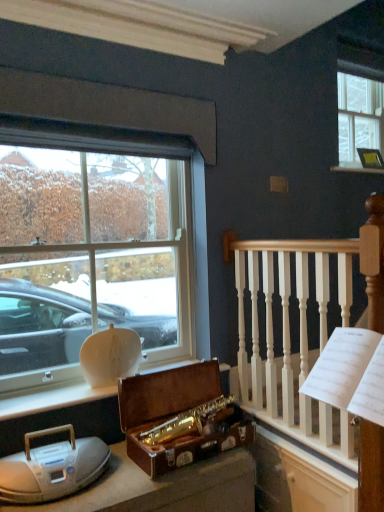
Question: Could you tell me if metallic gold picture frame at upper right is facing white wood railing at upper right?

Choices:
 (A) yes
 (B) no

Answer: (B)

Question: Is metallic gold picture frame at upper right closer to camera compared to white wood railing at upper right?

Choices:
 (A) no
 (B) yes

Answer: (A)

Question: Is metallic gold picture frame at upper right at the left side of white wood railing at upper right?

Choices:
 (A) yes
 (B) no

Answer: (B)

Question: Are metallic gold picture frame at upper right and white wood railing at upper right far apart?

Choices:
 (A) no
 (B) yes

Answer: (B)

Question: Does metallic gold picture frame at upper right have a lesser height compared to white wood railing at upper right?

Choices:
 (A) yes
 (B) no

Answer: (A)

Question: Is metallic gold picture frame at upper right taller or shorter than clear glass window at upper right, the 1th window from the top?

Choices:
 (A) short
 (B) tall

Answer: (A)

Question: Do you think metallic gold picture frame at upper right is within clear glass window at upper right, which is the 1th window from right to left, or outside of it?

Choices:
 (A) outside
 (B) inside

Answer: (A)

Question: Considering the positions of point (379, 152) and point (354, 140), is point (379, 152) closer or farther from the camera than point (354, 140)?

Choices:
 (A) farther
 (B) closer

Answer: (B)

Question: In the image, is metallic gold picture frame at upper right on the left side or the right side of clear glass window at upper right, which appears as the first window when viewed from the back?

Choices:
 (A) left
 (B) right

Answer: (A)

Question: From the image's perspective, is white wood railing at upper right located above or below white plastic radio at lower left?

Choices:
 (A) above
 (B) below

Answer: (A)

Question: In the image, is white wood railing at upper right positioned in front of or behind white plastic radio at lower left?

Choices:
 (A) behind
 (B) front

Answer: (B)

Question: Which is correct: white wood railing at upper right is inside white plastic radio at lower left, or outside of it?

Choices:
 (A) outside
 (B) inside

Answer: (A)

Question: From a real-world perspective, is white wood railing at upper right above or below white plastic radio at lower left?

Choices:
 (A) above
 (B) below

Answer: (A)

Question: From the image's perspective, is clear glass window at upper right, the second window from the front, located above or below metallic gold picture frame at upper right?

Choices:
 (A) above
 (B) below

Answer: (A)

Question: Considering the positions of clear glass window at upper right, which is the 2th window from bottom to top, and metallic gold picture frame at upper right in the image, is clear glass window at upper right, which is the 2th window from bottom to top, wider or thinner than metallic gold picture frame at upper right?

Choices:
 (A) thin
 (B) wide

Answer: (A)